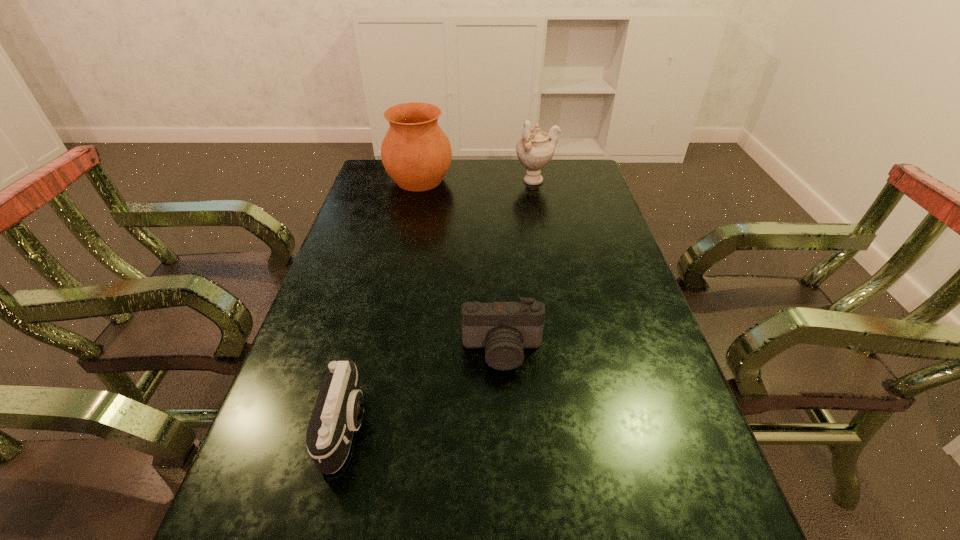
Locate an element on the screen. The width and height of the screenshot is (960, 540). pottery at the far edge is located at coordinates (416, 153).

Locate an element on the screen. The width and height of the screenshot is (960, 540). urn located at the far edge is located at coordinates (536, 148).

Where is `pottery located at the left edge`? pottery located at the left edge is located at coordinates (416, 153).

In order to click on camera located in the left edge section of the desktop in this screenshot , I will do `click(338, 412)`.

Where is `object present at the right edge`? The height and width of the screenshot is (540, 960). object present at the right edge is located at coordinates (536, 148).

Image resolution: width=960 pixels, height=540 pixels. Find the location of `object present at the far left corner`. object present at the far left corner is located at coordinates (416, 153).

This screenshot has height=540, width=960. What are the coordinates of `object present at the far right corner` in the screenshot? It's located at (536, 148).

In the image, there is a desktop. Find the location of `vacant space at the far edge`. vacant space at the far edge is located at coordinates (485, 182).

The width and height of the screenshot is (960, 540). In the image, there is a desktop. What are the coordinates of `free space at the left edge` in the screenshot? It's located at (362, 197).

The height and width of the screenshot is (540, 960). What are the coordinates of `free space at the right edge of the desktop` in the screenshot? It's located at (657, 439).